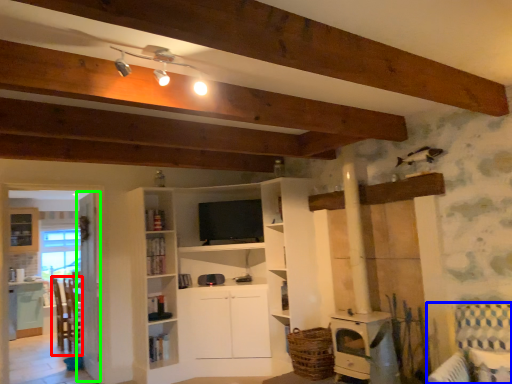
Question: Which is nearer to the chair (highlighted by a red box)? armchair (highlighted by a blue box) or glass door (highlighted by a green box).

Choices:
 (A) armchair
 (B) glass door

Answer: (B)